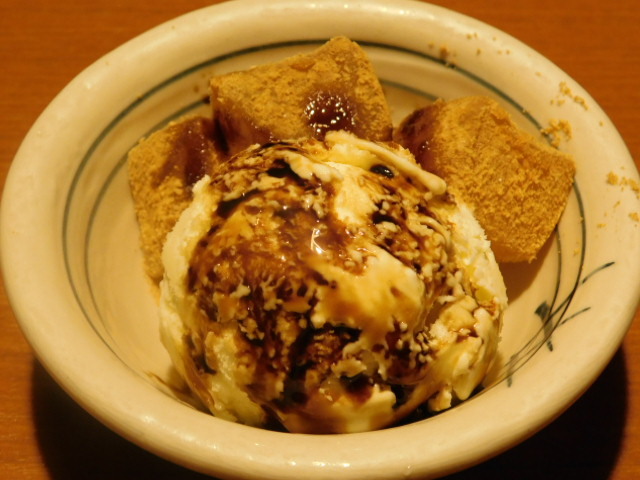
This screenshot has height=480, width=640. I want to click on white bowl, so click(550, 389).